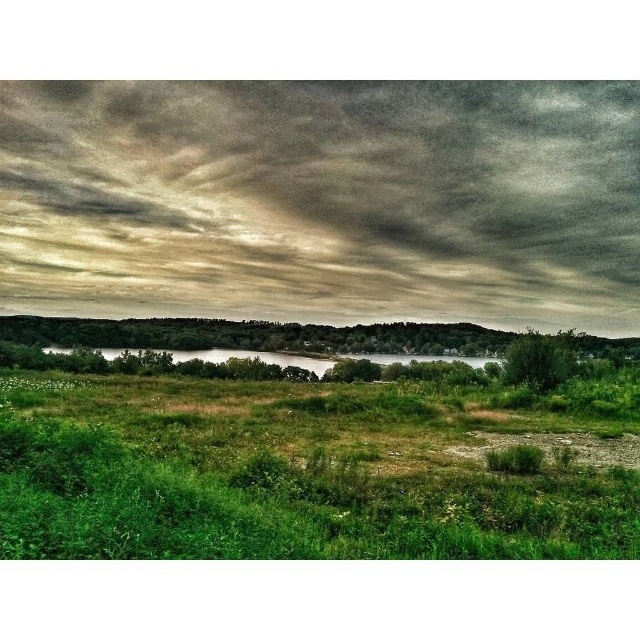
Question: Which of the following is the closest to the observer?

Choices:
 (A) gray/cloudy sky at upper center
 (B) green grass at center

Answer: (B)

Question: Is gray/cloudy sky at upper center bigger than green grass at center?

Choices:
 (A) no
 (B) yes

Answer: (B)

Question: Can you confirm if gray/cloudy sky at upper center is thinner than green grass at center?

Choices:
 (A) yes
 (B) no

Answer: (B)

Question: Which of the following is the closest to the observer?

Choices:
 (A) gray/cloudy sky at upper center
 (B) green grass at center

Answer: (B)

Question: Is gray/cloudy sky at upper center bigger than green grass at center?

Choices:
 (A) yes
 (B) no

Answer: (A)